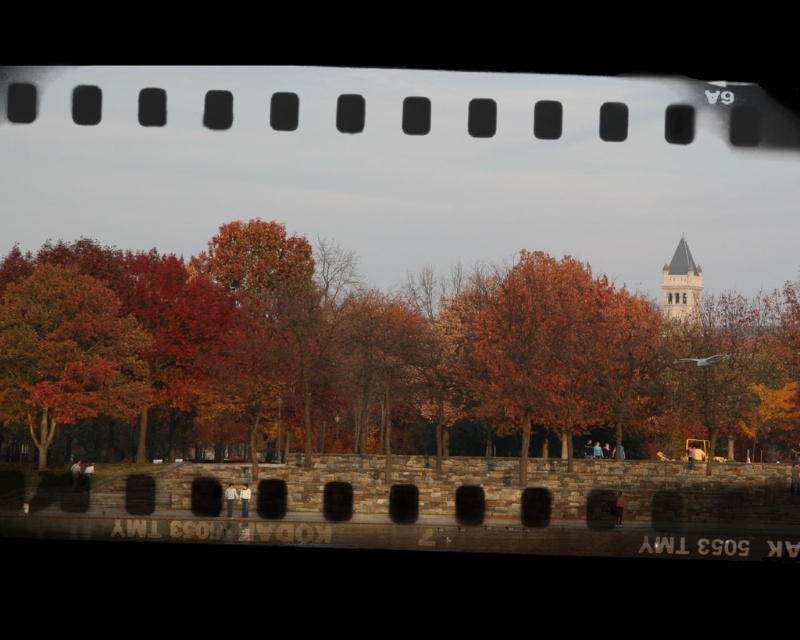
Does autumn leaves at center have a greater width compared to smooth white stone bell tower at upper right?

Yes, autumn leaves at center is wider than smooth white stone bell tower at upper right.

Is point (666, 356) more distant than point (686, 266)?

No, it is not.

The image size is (800, 640). What do you see at coordinates (374, 356) in the screenshot?
I see `autumn leaves at center` at bounding box center [374, 356].

This screenshot has width=800, height=640. In order to click on autumn leaves at center in this screenshot , I will do `click(374, 356)`.